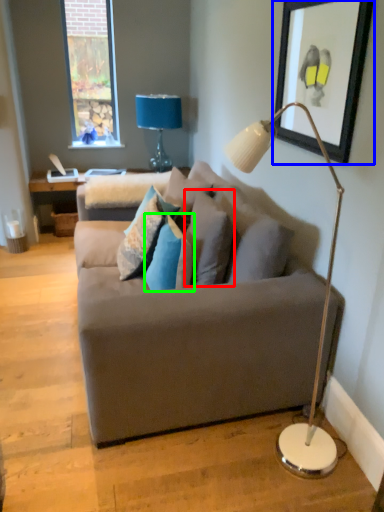
Question: Estimate the real-world distances between objects in this image. Which object is farther from pillow (highlighted by a red box), picture frame (highlighted by a blue box) or pillow (highlighted by a green box)?

Choices:
 (A) picture frame
 (B) pillow

Answer: (A)